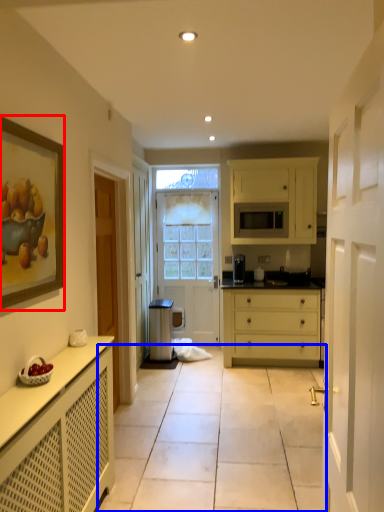
Question: Which point is closer to the camera, picture frame (highlighted by a red box) or path (highlighted by a blue box)?

Choices:
 (A) picture frame
 (B) path

Answer: (A)